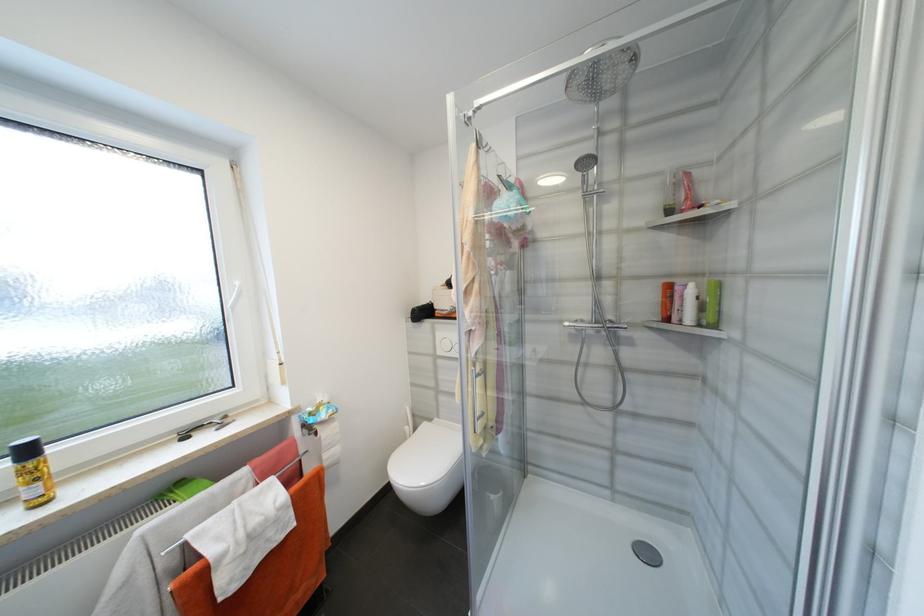
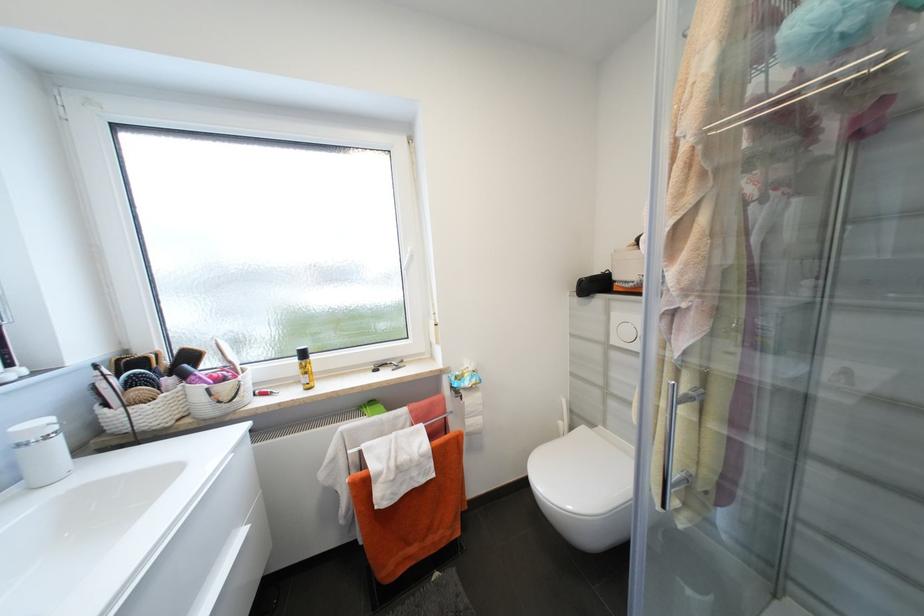
Question: The camera is either moving clockwise (left) or counter-clockwise (right) around the object. The first image is from the beginning of the video and the second image is from the end. Is the camera moving left or right when shooting the video?

Choices:
 (A) Left
 (B) Right

Answer: (B)